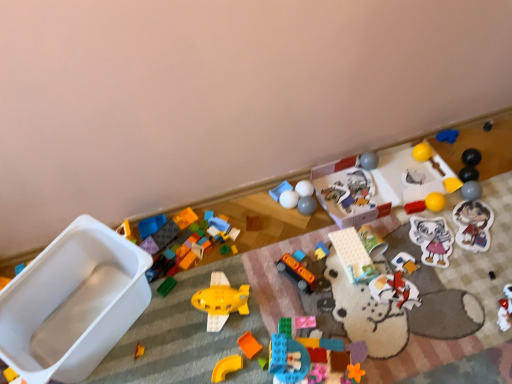
At what (x,y) coordinates should I click in order to perform the action: click on vacant space behind matte gray ball at center, which appears as the 14th toy when viewed from the left. Please return your answer as a coordinate pair (x, y). The width and height of the screenshot is (512, 384). Looking at the image, I should click on (311, 182).